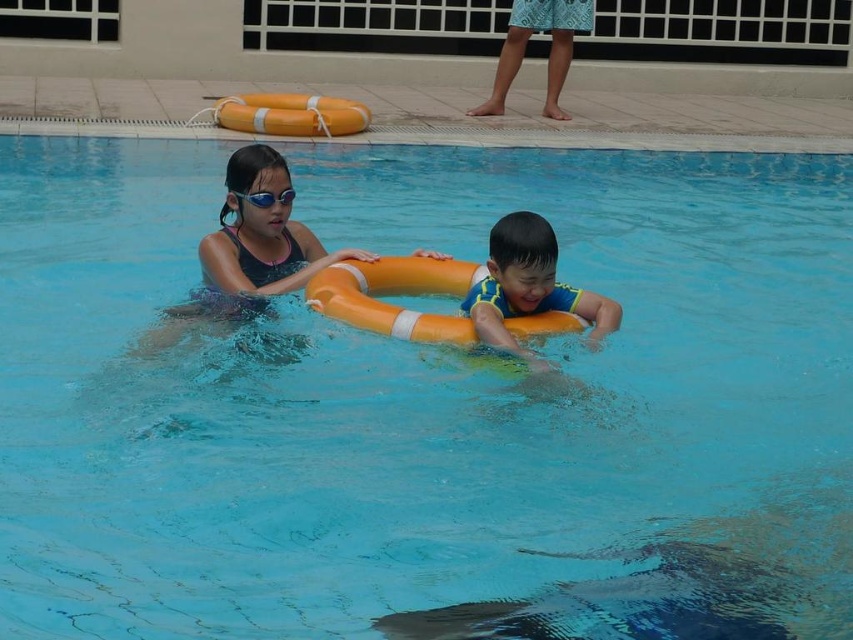
You are a lifeguard who needs to quickly assess the situation. Which object is directly on top of the other between the matte black swimsuit at center and the yellow foam ring at center?

The matte black swimsuit at center is positioned over the yellow foam ring at center, so the swimsuit is directly on top of the foam ring.

You are standing at the edge of the pool and want to reach a point marked at coordinates point (x=215, y=275). If you can swim 15 feet in 10 seconds, how long will it take you to reach that point?

The distance to point (x=215, y=275) is 16.14 feet. At a rate of 15 feet per 10 seconds, it would take approximately 10.76 seconds to reach the point.

You are a lifeguard standing at the edge of the pool. You need to retrieve the yellow foam ring at center and the transparent plastic goggles at upper center. Which object should you reach for first if you want to grab the one closer to you?

The yellow foam ring at center is in front of the transparent plastic goggles at upper center, so you should reach for the yellow foam ring at center first since it is closer to you.